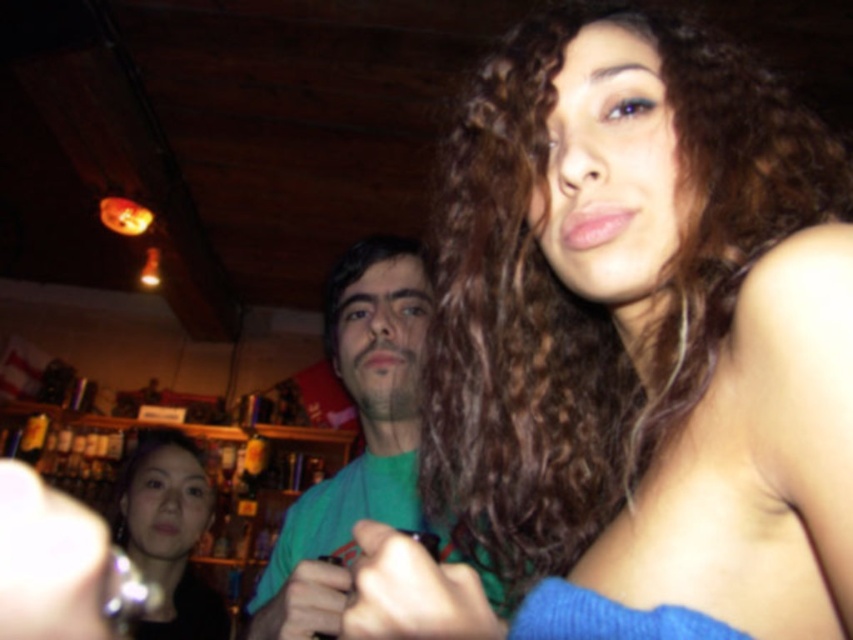
Is blue fabric top at upper right wider than matte green hand at center?

Yes.

Is blue fabric top at upper right to the left of matte green hand at center from the viewer's perspective?

Incorrect, blue fabric top at upper right is not on the left side of matte green hand at center.

At what (x,y) coordinates should I click in order to perform the action: click on blue fabric top at upper right. Please return your answer as a coordinate pair (x, y). The image size is (853, 640). Looking at the image, I should click on (633, 349).

This screenshot has height=640, width=853. Identify the location of smooth skin face at lower left. (167, 534).

Is smooth skin face at lower left to the left of matte green shirt at center from the viewer's perspective?

Yes, smooth skin face at lower left is to the left of matte green shirt at center.

Locate an element on the screen. smooth skin face at lower left is located at coordinates tap(167, 534).

Locate an element on the screen. smooth skin face at lower left is located at coordinates (167, 534).

Who is positioned more to the right, matte black phone at lower left or matte green hand at center?

matte green hand at center is more to the right.

What do you see at coordinates (48, 561) in the screenshot? The image size is (853, 640). I see `matte black phone at lower left` at bounding box center [48, 561].

This screenshot has height=640, width=853. I want to click on matte black phone at lower left, so click(48, 561).